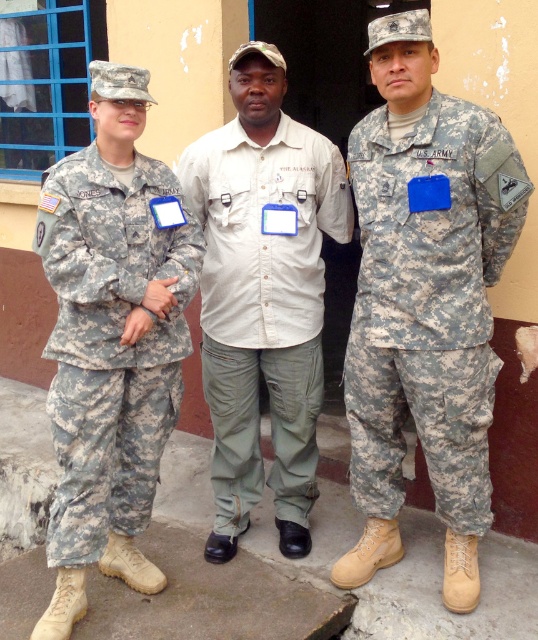
Between point (466, 109) and point (116, 216), which one is positioned behind?

The point (116, 216) is behind.

Between camouflage fabric uniform at center and camouflage fabric pants at left, which one has less height?

camouflage fabric pants at left

The width and height of the screenshot is (538, 640). What do you see at coordinates (423, 268) in the screenshot?
I see `camouflage fabric uniform at center` at bounding box center [423, 268].

Identify the location of camouflage fabric uniform at center. This screenshot has width=538, height=640. (423, 268).

Who is more forward, (314, 154) or (476, 227)?

Point (476, 227) is more forward.

Can you confirm if light beige cotton shirt at center is bigger than camouflage fabric uniform at center?

Correct, light beige cotton shirt at center is larger in size than camouflage fabric uniform at center.

What do you see at coordinates (264, 296) in the screenshot? I see `light beige cotton shirt at center` at bounding box center [264, 296].

This screenshot has width=538, height=640. In order to click on light beige cotton shirt at center in this screenshot , I will do `click(264, 296)`.

Does light beige cotton shirt at center have a lesser height compared to camouflage fabric pants at left?

No.

Is light beige cotton shirt at center behind camouflage fabric pants at left?

Yes, light beige cotton shirt at center is behind camouflage fabric pants at left.

Between point (235, 54) and point (103, 512), which one is positioned in front?

Point (103, 512)

Find the location of `light beige cotton shirt at center`. light beige cotton shirt at center is located at coordinates (264, 296).